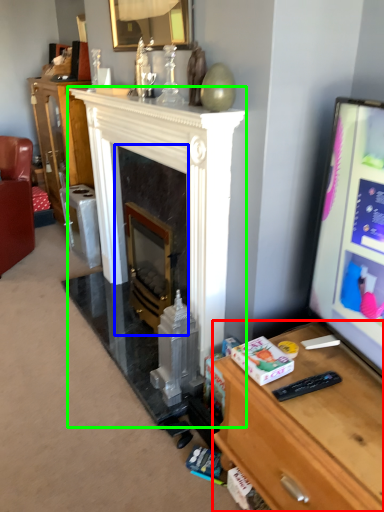
Question: Based on their relative distances, which object is nearer to desk (highlighted by a red box)? Choose from fireplace (highlighted by a blue box) and fireplace (highlighted by a green box).

Choices:
 (A) fireplace
 (B) fireplace

Answer: (B)